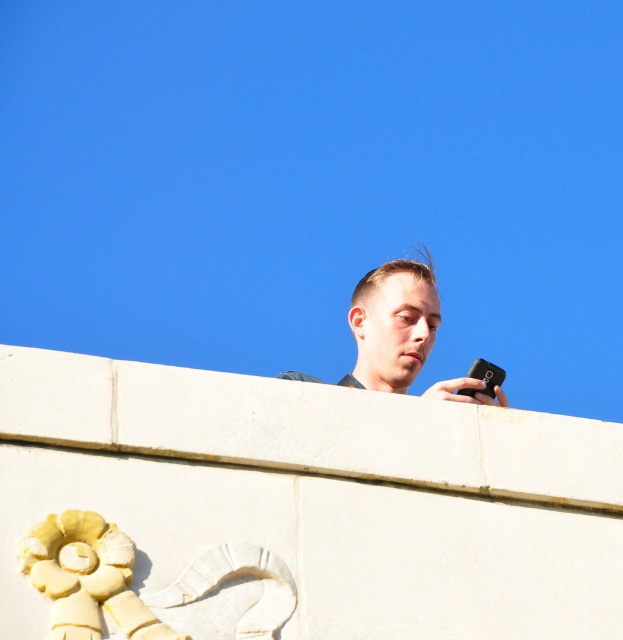
In the scene shown: You are a drone operator trying to navigate between two points marked as point (424, 364) and point (488, 388). Which point is closer to your drone if you are flying towards them?

Point (424, 364) is further to the viewer than point (488, 388), so the closer point to the drone would be point (488, 388).

You are a photographer trying to capture both the matte black phone at upper center and the black matte smartphone at upper right in a single frame. Which phone has a greater width?

The matte black phone at upper center has a greater width than the black matte smartphone at upper right.